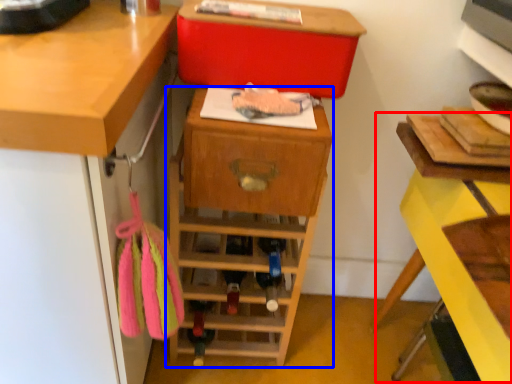
Question: Which object appears closest to the camera in this image, computer desk (highlighted by a red box) or shelf (highlighted by a blue box)?

Choices:
 (A) computer desk
 (B) shelf

Answer: (A)